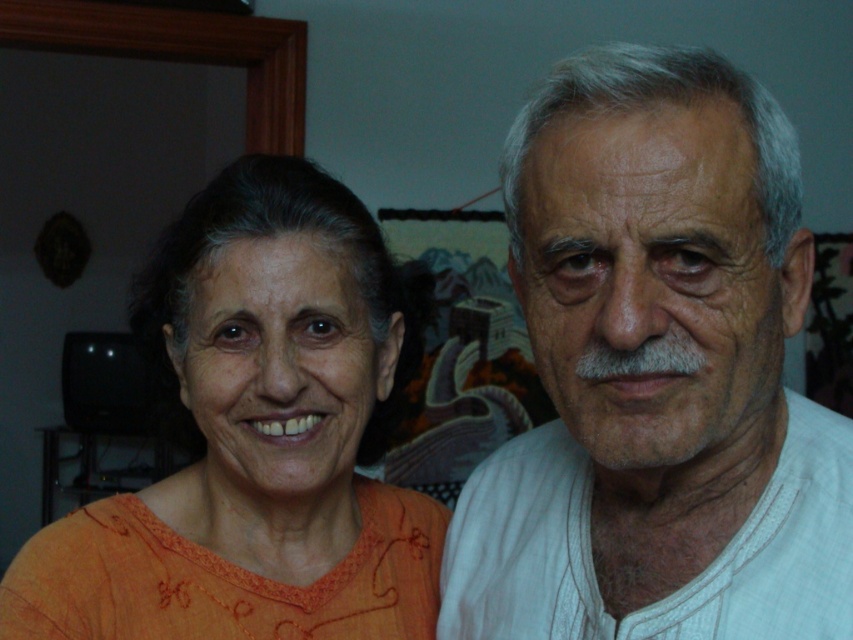
Based on the photo, you are standing in front of the couple in the image. The man is wearing a light colored traditional garment. There is a specific point at coordinates (656, 376). What object is located at that point?

The white cotton shirt at right is located at point (656, 376).

Looking at this image, you are standing in the room where the two people are. You see two points marked in the image. The first point is at coordinate point (x=703, y=129) and the second point is at coordinate point (x=229, y=253). Which point is closer to you?

Point (x=703, y=129) is in front of point (x=229, y=253), so it is closer to you.